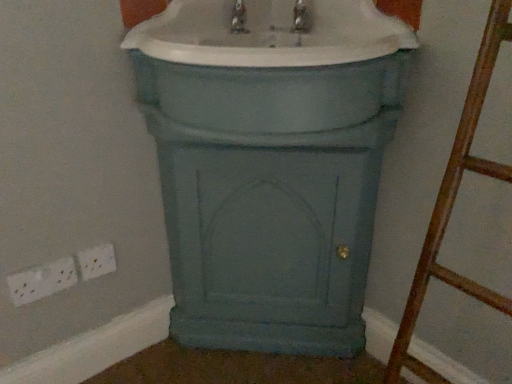
Question: Is white plastic socket at lower left, which ranks as the 2th electric outlet in right-to-left order, further to camera compared to matte blue cabinet at center?

Choices:
 (A) no
 (B) yes

Answer: (B)

Question: Considering the relative sizes of white plastic socket at lower left, the 1th electric outlet in the left-to-right sequence, and matte blue cabinet at center in the image provided, is white plastic socket at lower left, the 1th electric outlet in the left-to-right sequence, taller than matte blue cabinet at center?

Choices:
 (A) no
 (B) yes

Answer: (A)

Question: Is white plastic socket at lower left, which ranks as the 2th electric outlet in right-to-left order, thinner than matte blue cabinet at center?

Choices:
 (A) no
 (B) yes

Answer: (B)

Question: Does white plastic socket at lower left, the 1th electric outlet in the left-to-right sequence, turn towards matte blue cabinet at center?

Choices:
 (A) yes
 (B) no

Answer: (B)

Question: Can you confirm if white plastic socket at lower left, which ranks as the 2th electric outlet in right-to-left order, is smaller than matte blue cabinet at center?

Choices:
 (A) yes
 (B) no

Answer: (A)

Question: Would you say matte blue cabinet at center is to the left or to the right of matte blue cabinet at center in the picture?

Choices:
 (A) left
 (B) right

Answer: (A)

Question: Considering the positions of matte blue cabinet at center and matte blue cabinet at center in the image, is matte blue cabinet at center taller or shorter than matte blue cabinet at center?

Choices:
 (A) tall
 (B) short

Answer: (A)

Question: From a real-world perspective, is matte blue cabinet at center physically located above or below matte blue cabinet at center?

Choices:
 (A) above
 (B) below

Answer: (B)

Question: From the image's perspective, is matte blue cabinet at center above or below matte blue cabinet at center?

Choices:
 (A) below
 (B) above

Answer: (A)

Question: Would you say white plastic electric outlet at lower left, the 2th electric outlet when ordered from left to right, is inside or outside white plastic socket at lower left, which ranks as the 2th electric outlet in right-to-left order?

Choices:
 (A) inside
 (B) outside

Answer: (B)

Question: From the image's perspective, is white plastic electric outlet at lower left, the 2th electric outlet when ordered from left to right, above or below white plastic socket at lower left, the 1th electric outlet in the left-to-right sequence?

Choices:
 (A) below
 (B) above

Answer: (B)

Question: In terms of width, does white plastic electric outlet at lower left, the 2th electric outlet when ordered from left to right, look wider or thinner when compared to white plastic socket at lower left, the 1th electric outlet in the left-to-right sequence?

Choices:
 (A) wide
 (B) thin

Answer: (B)

Question: Based on their sizes in the image, would you say white plastic electric outlet at lower left, the 2th electric outlet when ordered from left to right, is bigger or smaller than white plastic socket at lower left, which ranks as the 2th electric outlet in right-to-left order?

Choices:
 (A) big
 (B) small

Answer: (B)

Question: Is matte blue cabinet at center to the left or to the right of white plastic electric outlet at lower left, the first electric outlet positioned from the right, in the image?

Choices:
 (A) right
 (B) left

Answer: (A)

Question: From the image's perspective, is matte blue cabinet at center positioned above or below white plastic electric outlet at lower left, the first electric outlet positioned from the right?

Choices:
 (A) above
 (B) below

Answer: (A)